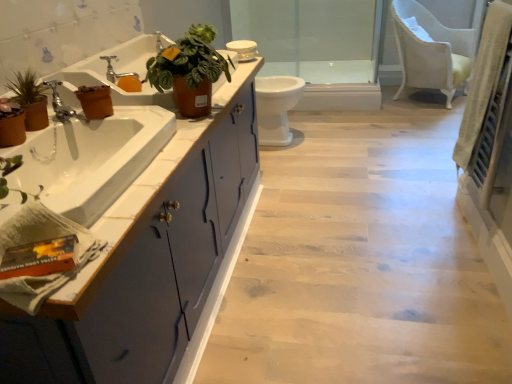
Question: Considering the positions of matte brown flowerpot at left, which appears as the 2th flowerpot when viewed from the top, and leather-like terracotta pot at upper center, which appears as the 1th houseplant when viewed from the right, in the image, is matte brown flowerpot at left, which appears as the 2th flowerpot when viewed from the top, bigger or smaller than leather-like terracotta pot at upper center, which appears as the 1th houseplant when viewed from the right,?

Choices:
 (A) big
 (B) small

Answer: (B)

Question: In terms of width, does matte brown flowerpot at left, which appears as the 2th flowerpot when viewed from the top, look wider or thinner when compared to leather-like terracotta pot at upper center, which appears as the 1th houseplant when viewed from the right?

Choices:
 (A) wide
 (B) thin

Answer: (B)

Question: Based on their relative distances, which object is farther from the matte brown pot at left, which is counted as the first houseplant, starting from the left?

Choices:
 (A) white fabric chair at upper right
 (B) transparent glass door at center
 (C) white glossy toilet at center
 (D) brown terracotta pot at left, which is the second flowerpot in bottom-to-top order
 (E) leather-like terracotta pot at upper center, which appears as the 1th houseplant when viewed from the right

Answer: (B)

Question: Considering the real-world distances, which object is farthest from the matte brown pot at left, arranged as the 2th houseplant when viewed from the right?

Choices:
 (A) transparent glass door at center
 (B) brown terracotta pot at left, the first flowerpot in the top-to-bottom sequence
 (C) leather-like terracotta pot at upper center, which appears as the 1th houseplant when viewed from the right
 (D) white glossy toilet at center
 (E) brushed metal faucet at left, which is the first tap in front-to-back order

Answer: (A)